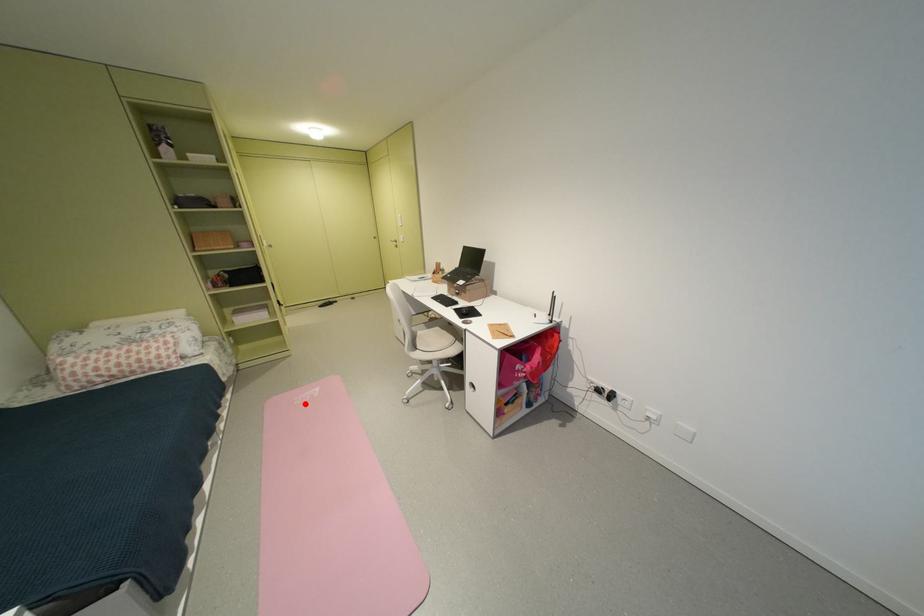
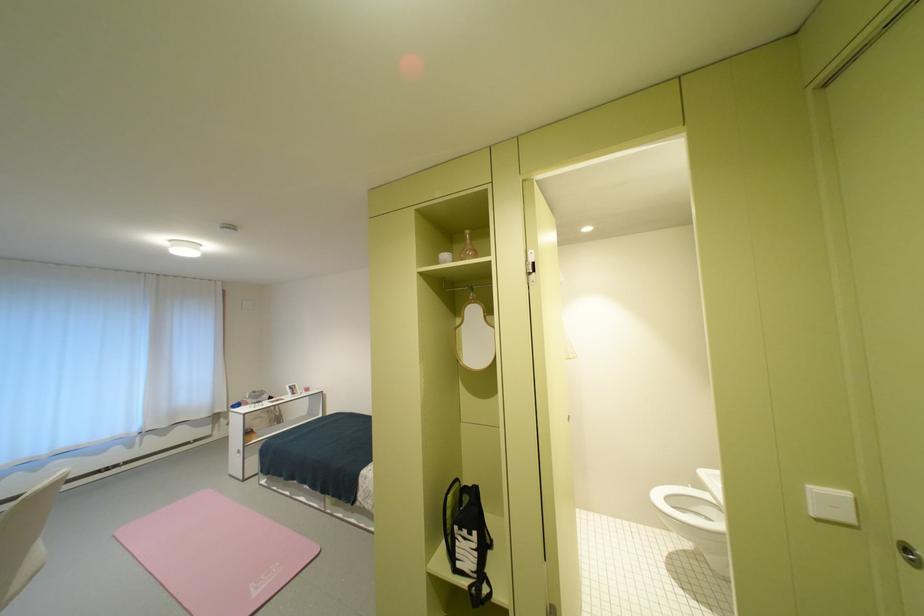
Find the pixel in the second image that matches the highlighted location in the first image.

(286, 565)